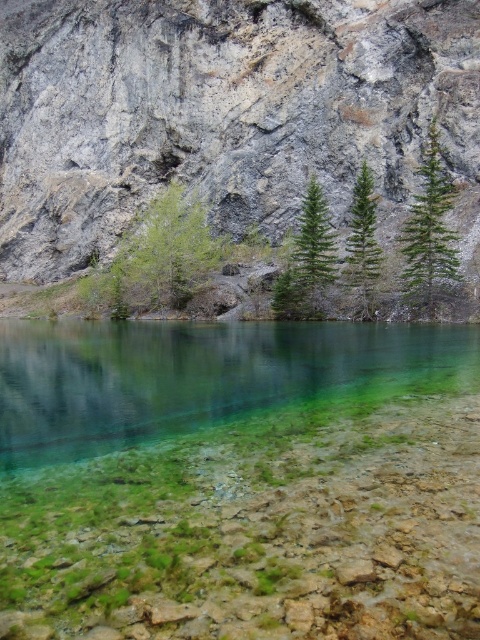
You are standing at the edge of the clear glassy water at center and want to see the green matte tree at center. Which direction should you look to see the tree?

The green matte tree at center is taller than the clear glassy water at center, so you should look upward to see the green matte tree at center.

You are standing at the edge of the water in the scene. You see two points marked in the image. The first point is at coordinates point [130,381] and the second is at point [363,232]. Which point is closer to you?

Point [130,381] is in front of point [363,232], so the first point is closer to you.

You are standing at the edge of the landscape and want to throw a small pebble into the clear glassy water at center. Considering the distance, can you estimate if you can reach it with an average throwing distance of 30 meters?

The clear glassy water at center is 30.93 meters away from the viewer. Since the average throwing distance is 30 meters, you might not be able to reach it as the distance is slightly beyond your range.